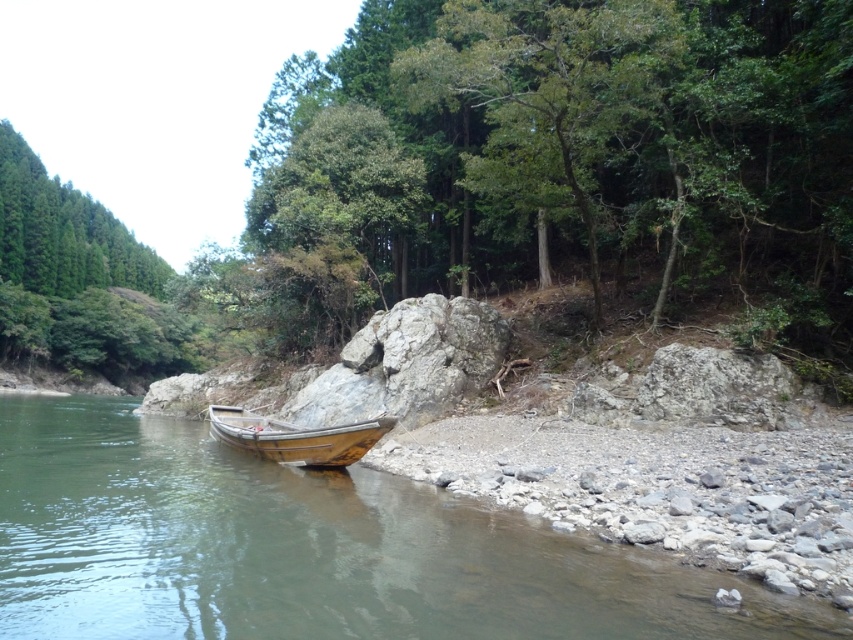
Question: Based on their relative distances, which object is nearer to the wooden boat at center?

Choices:
 (A) wooden boat at lower left
 (B) green leafy tree at center

Answer: (A)

Question: Which object is the closest to the wooden boat at lower left?

Choices:
 (A) green leafy tree at center
 (B) wooden boat at center

Answer: (B)

Question: Which of the following is the closest to the observer?

Choices:
 (A) (351, 109)
 (B) (282, 433)
 (C) (212, 602)

Answer: (C)

Question: Does green leafy tree at center have a lesser width compared to wooden boat at lower left?

Choices:
 (A) yes
 (B) no

Answer: (A)

Question: Can you confirm if wooden boat at lower left is smaller than wooden boat at center?

Choices:
 (A) no
 (B) yes

Answer: (A)

Question: Can you confirm if green leafy tree at center is positioned above wooden boat at lower left?

Choices:
 (A) yes
 (B) no

Answer: (A)